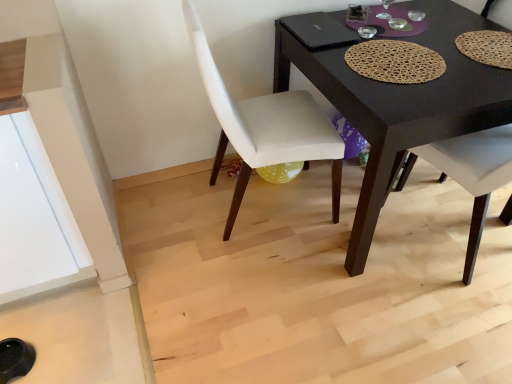
Locate an element on the screen. The height and width of the screenshot is (384, 512). vacant space in front of brown woven placemat at center is located at coordinates (426, 102).